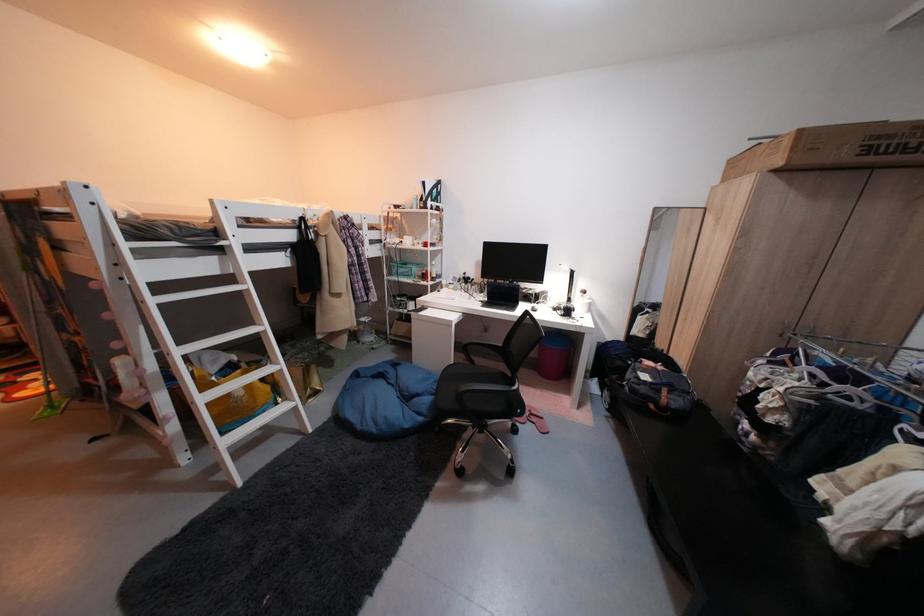
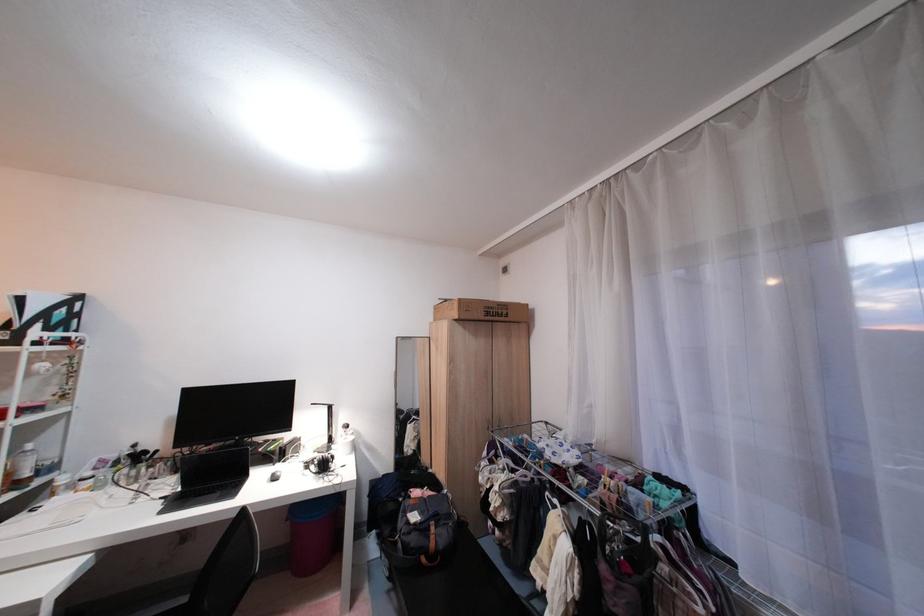
Locate, in the second image, the point that corresponds to [569,304] in the first image.

(326, 450)